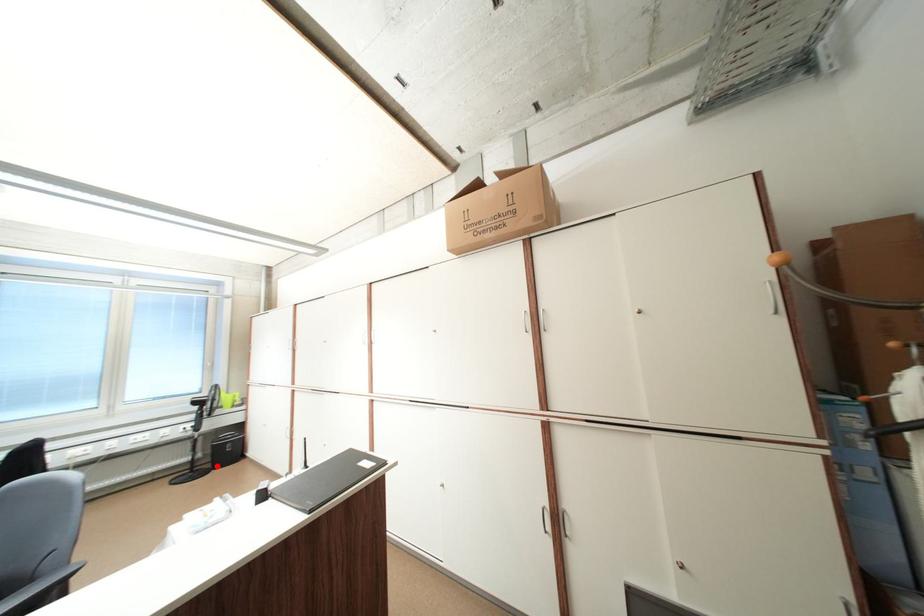
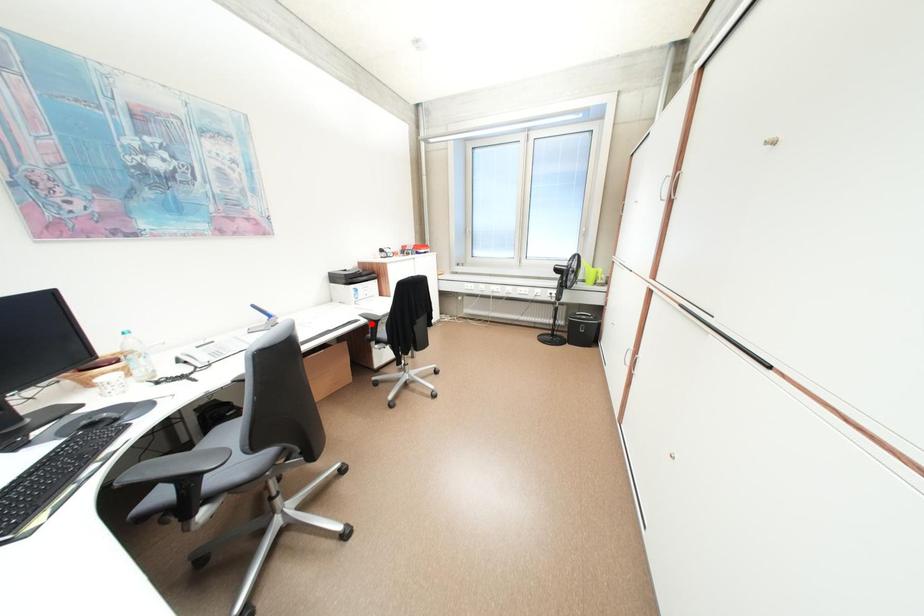
I am providing you with two images of the same scene from different viewpoints. A red point is marked on the first image and another point is marked on the second image. Is the red point in image1 aligned with the point shown in image2?

No